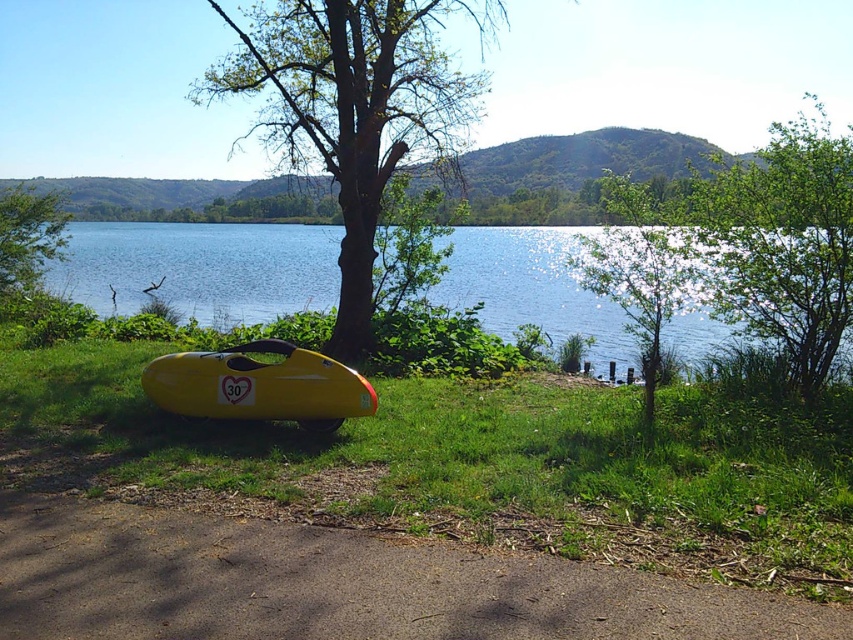
At what (x,y) coordinates should I click in order to perform the action: click on green grass at center. Please return your answer as a coordinate pair (x, y). Image resolution: width=853 pixels, height=640 pixels. Looking at the image, I should click on (489, 460).

The height and width of the screenshot is (640, 853). What do you see at coordinates (489, 460) in the screenshot?
I see `green grass at center` at bounding box center [489, 460].

Looking at this image, measure the distance between green grass at center and camera.

green grass at center is 13.93 feet from camera.

The width and height of the screenshot is (853, 640). In order to click on green grass at center in this screenshot , I will do `click(489, 460)`.

Is green matte tree at center above green matte tree at lower left?

Yes, green matte tree at center is above green matte tree at lower left.

Which is below, green matte tree at center or green matte tree at lower left?

green matte tree at lower left is below.

Between point (453, 134) and point (32, 228), which one is positioned in front?

Positioned in front is point (32, 228).

The image size is (853, 640). I want to click on green matte tree at center, so click(352, 108).

Does green grass at center have a lesser width compared to yellow matte boat at lower center?

Incorrect, green grass at center's width is not less than yellow matte boat at lower center's.

Who is more forward, [474,515] or [271,380]?

Point [474,515] is more forward.

This screenshot has width=853, height=640. I want to click on green grass at center, so click(x=489, y=460).